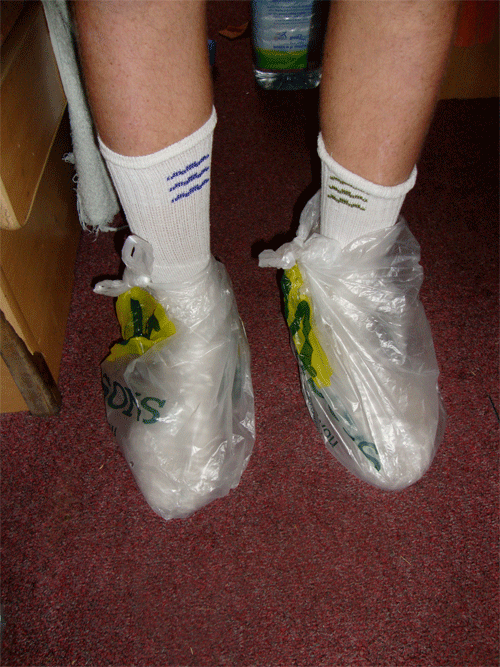
Find the location of a particular element. wooden dresser is located at coordinates (54, 273), (25, 145), (7, 401).